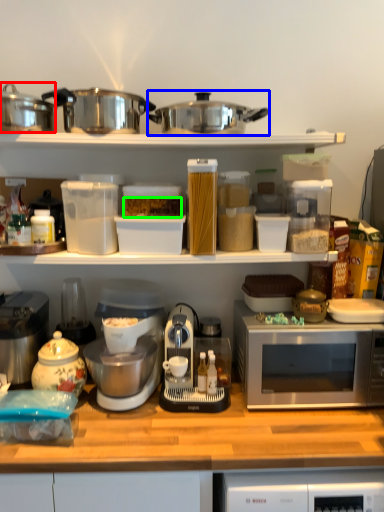
Question: Estimate the real-world distances between objects in this image. Which object is farther from kitchen appliance (highlighted by a red box), crock pot (highlighted by a blue box) or food (highlighted by a green box)?

Choices:
 (A) crock pot
 (B) food

Answer: (A)